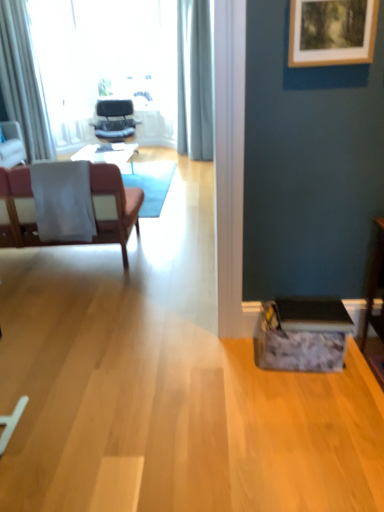
Measure the distance between point (38, 93) and camera.

Point (38, 93) and camera are 11.69 feet apart from each other.

Locate an element on the screen. light gray fabric curtain at upper center, acting as the second curtain starting from the left is located at coordinates (194, 80).

The image size is (384, 512). Identify the location of matte pink chair at left, arranged as the 2th chair when ordered from the bottom. (12, 145).

Find the location of a particular element. This screenshot has height=512, width=384. pink fabric chair at left, which appears as the first chair when ordered from the bottom is located at coordinates (113, 207).

Is the surface of light gray fabric curtain at upper center, acting as the second curtain starting from the left, in direct contact with white sheer curtain at left, the 2th curtain in the right-to-left sequence?

There is a gap between light gray fabric curtain at upper center, acting as the second curtain starting from the left, and white sheer curtain at left, the 2th curtain in the right-to-left sequence.

From the image's perspective, relative to white sheer curtain at left, the first curtain when ordered from left to right, is light gray fabric curtain at upper center, the 1th curtain positioned from the right, above or below?

light gray fabric curtain at upper center, the 1th curtain positioned from the right, is situated higher than white sheer curtain at left, the first curtain when ordered from left to right, in the image.

Identify the location of curtain below the light gray fabric curtain at upper center, acting as the second curtain starting from the left (from the image's perspective). (23, 81).

Does point (16, 245) come farther from viewer compared to point (195, 33)?

No, it is in front of (195, 33).

Which is more to the left, pink fabric chair at left, which appears as the first chair when ordered from the bottom, or light gray fabric curtain at upper center, acting as the second curtain starting from the left?

From the viewer's perspective, pink fabric chair at left, which appears as the first chair when ordered from the bottom, appears more on the left side.

From the image's perspective, does pink fabric chair at left, the 3th chair when ordered from back to front, appear higher than light gray fabric curtain at upper center, acting as the second curtain starting from the left?

No, from the image's perspective, pink fabric chair at left, the 3th chair when ordered from back to front, is not on top of light gray fabric curtain at upper center, acting as the second curtain starting from the left.

Which of these two, pink fabric chair at left, which appears as the first chair when ordered from the bottom, or matte black chair at center, the 1th chair when ordered from back to front, stands shorter?

matte black chair at center, the 1th chair when ordered from back to front, is shorter.

Is pink fabric chair at left, the first chair from the right, bigger or smaller than matte black chair at center, which is the 2th chair from left to right?

In the image, pink fabric chair at left, the first chair from the right, appears to be larger than matte black chair at center, which is the 2th chair from left to right.

Can you tell me how much pink fabric chair at left, arranged as the 3th chair when viewed from the top, and matte black chair at center, arranged as the second chair when viewed from the right, differ in facing direction?

174 degrees.

The image size is (384, 512). I want to click on picture frame above the matte pink chair at left, positioned as the second chair in front-to-back order (from a real-world perspective), so click(332, 32).

Based on their sizes in the image, would you say wooden picture frame at upper right is bigger or smaller than matte pink chair at left, placed as the second chair when sorted from top to bottom?

wooden picture frame at upper right is smaller than matte pink chair at left, placed as the second chair when sorted from top to bottom.

Is wooden picture frame at upper right looking in the opposite direction of matte pink chair at left, which ranks as the 3th chair in right-to-left order?

wooden picture frame at upper right does not have its back to matte pink chair at left, which ranks as the 3th chair in right-to-left order.

Consider the image. Measure the distance between light gray fabric curtain at upper center, acting as the second curtain starting from the left, and wooden picture frame at upper right.

A distance of 13.37 feet exists between light gray fabric curtain at upper center, acting as the second curtain starting from the left, and wooden picture frame at upper right.

Are light gray fabric curtain at upper center, acting as the second curtain starting from the left, and wooden picture frame at upper right making contact?

There is a gap between light gray fabric curtain at upper center, acting as the second curtain starting from the left, and wooden picture frame at upper right.

Which point is more forward, (x=187, y=24) or (x=316, y=8)?

Point (x=316, y=8)

This screenshot has height=512, width=384. I want to click on picture frame that appears on the right of light gray fabric curtain at upper center, acting as the second curtain starting from the left, so click(x=332, y=32).

Between wooden picture frame at upper right and white sheer curtain at left, the 2th curtain in the right-to-left sequence, which one has larger size?

white sheer curtain at left, the 2th curtain in the right-to-left sequence, is bigger.

Can you confirm if wooden picture frame at upper right is wider than white sheer curtain at left, the 2th curtain in the right-to-left sequence?

Incorrect, the width of wooden picture frame at upper right does not surpass that of white sheer curtain at left, the 2th curtain in the right-to-left sequence.

Can you tell me how much wooden picture frame at upper right and white sheer curtain at left, the first curtain when ordered from left to right, differ in facing direction?

The angular difference between wooden picture frame at upper right and white sheer curtain at left, the first curtain when ordered from left to right, is 23.2 degrees.

Which object is positioned more to the left, pink fabric chair at left, arranged as the 3th chair when viewed from the top, or wooden picture frame at upper right?

From the viewer's perspective, pink fabric chair at left, arranged as the 3th chair when viewed from the top, appears more on the left side.

Does pink fabric chair at left, the 3th chair when ordered from back to front, lie in front of wooden picture frame at upper right?

No, pink fabric chair at left, the 3th chair when ordered from back to front, is further to the viewer.

From a real-world perspective, is pink fabric chair at left, which appears as the first chair when ordered from the bottom, on top of wooden picture frame at upper right?

No, from a real-world perspective, pink fabric chair at left, which appears as the first chair when ordered from the bottom, is not over wooden picture frame at upper right

Is pink fabric chair at left, the third chair from the left, positioned far away from wooden picture frame at upper right?

Indeed, pink fabric chair at left, the third chair from the left, is not near wooden picture frame at upper right.

This screenshot has height=512, width=384. In order to click on curtain above the white sheer curtain at left, the first curtain when ordered from left to right (from the image's perspective) in this screenshot , I will do `click(194, 80)`.

This screenshot has height=512, width=384. Find the location of `the 3rd chair directly beneath the light gray fabric curtain at upper center, acting as the second curtain starting from the left (from a real-world perspective)`. the 3rd chair directly beneath the light gray fabric curtain at upper center, acting as the second curtain starting from the left (from a real-world perspective) is located at coordinates (113, 207).

From the image, which object appears to be farther from matte pink chair at left, placed as the second chair when sorted from top to bottom, wooden picture frame at upper right or matte black chair at center, which appears as the 1th chair when viewed from the top?

wooden picture frame at upper right lies further to matte pink chair at left, placed as the second chair when sorted from top to bottom, than the other object.

Which object lies further to the anchor point wooden picture frame at upper right, pink fabric chair at left, which appears as the first chair when ordered from the bottom, or matte black chair at center, which is the 2th chair from left to right?

A: The object further to wooden picture frame at upper right is matte black chair at center, which is the 2th chair from left to right.

Considering their positions, is matte pink chair at left, which ranks as the second chair in back-to-front order, positioned closer to pink fabric chair at left, the third chair from the left, than matte black chair at center, arranged as the second chair when viewed from the right?

The object closer to pink fabric chair at left, the third chair from the left, is matte pink chair at left, which ranks as the second chair in back-to-front order.

Looking at the image, which one is located closer to matte black chair at center, which is the 2th chair from left to right, white sheer curtain at left, the 2th curtain in the right-to-left sequence, or light gray fabric curtain at upper center, acting as the second curtain starting from the left?

Based on the image, light gray fabric curtain at upper center, acting as the second curtain starting from the left, appears to be nearer to matte black chair at center, which is the 2th chair from left to right.

Which object lies nearer to the anchor point matte pink chair at left, arranged as the 2th chair when ordered from the bottom, matte black chair at center, arranged as the second chair when viewed from the right, or white sheer curtain at left, the 2th curtain in the right-to-left sequence?

white sheer curtain at left, the 2th curtain in the right-to-left sequence, is closer to matte pink chair at left, arranged as the 2th chair when ordered from the bottom.

Looking at this image, estimate the real-world distances between objects in this image. Which object is closer to light gray fabric curtain at upper center, the 1th curtain positioned from the right, wooden picture frame at upper right or white sheer curtain at left, the first curtain when ordered from left to right?

white sheer curtain at left, the first curtain when ordered from left to right, is positioned closer to the anchor light gray fabric curtain at upper center, the 1th curtain positioned from the right.

Based on their spatial positions, is matte pink chair at left, which is counted as the 1th chair, starting from the left, or matte black chair at center, arranged as the second chair when viewed from the right, further from wooden picture frame at upper right?

matte black chair at center, arranged as the second chair when viewed from the right.

Which object lies nearer to the anchor point matte pink chair at left, which is counted as the 1th chair, starting from the left, white sheer curtain at left, the 2th curtain in the right-to-left sequence, or pink fabric chair at left, acting as the first chair starting from the front?

white sheer curtain at left, the 2th curtain in the right-to-left sequence, is positioned closer to the anchor matte pink chair at left, which is counted as the 1th chair, starting from the left.

Locate an element on the screen. The image size is (384, 512). curtain located between pink fabric chair at left, the first chair from the right, and white sheer curtain at left, the 2th curtain in the right-to-left sequence, in the depth direction is located at coordinates [194, 80].

What are the coordinates of `chair positioned between wooden picture frame at upper right and matte pink chair at left, placed as the second chair when sorted from top to bottom, from near to far` in the screenshot? It's located at (113, 207).

Identify the location of curtain between matte pink chair at left, arranged as the 2th chair when ordered from the bottom, and light gray fabric curtain at upper center, the 1th curtain positioned from the right, in the horizontal direction. The image size is (384, 512). (23, 81).

Find the location of `chair between pink fabric chair at left, the first chair from the right, and matte black chair at center, acting as the third chair starting from the front, in the front-back direction`. chair between pink fabric chair at left, the first chair from the right, and matte black chair at center, acting as the third chair starting from the front, in the front-back direction is located at coordinates (12, 145).